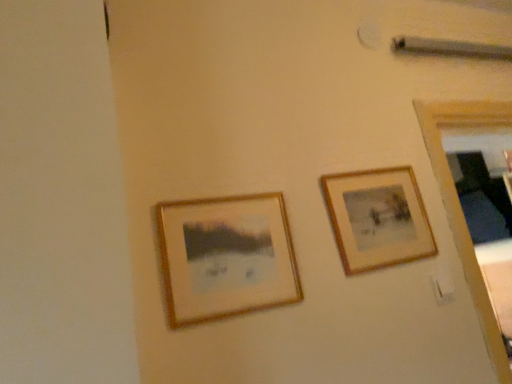
Question: Is wooden framed picture at center left, arranged as the first picture frame when viewed from the left, to the left or to the right of wooden frame at upper right, marked as the 1th picture frame in a back-to-front arrangement, in the image?

Choices:
 (A) right
 (B) left

Answer: (B)

Question: Looking at the image, does wooden framed picture at center left, arranged as the first picture frame when viewed from the left, seem bigger or smaller compared to wooden frame at upper right, which appears as the second picture frame when viewed from the front?

Choices:
 (A) small
 (B) big

Answer: (A)

Question: From the image's perspective, relative to wooden frame at upper right, placed as the second picture frame when sorted from left to right, is wooden framed picture at center left, which is the second picture frame from back to front, above or below?

Choices:
 (A) below
 (B) above

Answer: (A)

Question: Considering the positions of wooden frame at upper right, placed as the second picture frame when sorted from left to right, and wooden framed picture at center left, the first picture frame in the front-to-back sequence, in the image, is wooden frame at upper right, placed as the second picture frame when sorted from left to right, wider or thinner than wooden framed picture at center left, the first picture frame in the front-to-back sequence,?

Choices:
 (A) thin
 (B) wide

Answer: (A)

Question: Is wooden frame at upper right, marked as the 1th picture frame in a back-to-front arrangement, taller or shorter than wooden framed picture at center left, the first picture frame in the front-to-back sequence?

Choices:
 (A) short
 (B) tall

Answer: (B)

Question: Is point (404, 215) closer or farther from the camera than point (253, 281)?

Choices:
 (A) farther
 (B) closer

Answer: (A)

Question: Is wooden frame at upper right, placed as the second picture frame when sorted from left to right, in front of or behind wooden framed picture at center left, which is the second picture frame from back to front, in the image?

Choices:
 (A) behind
 (B) front

Answer: (A)